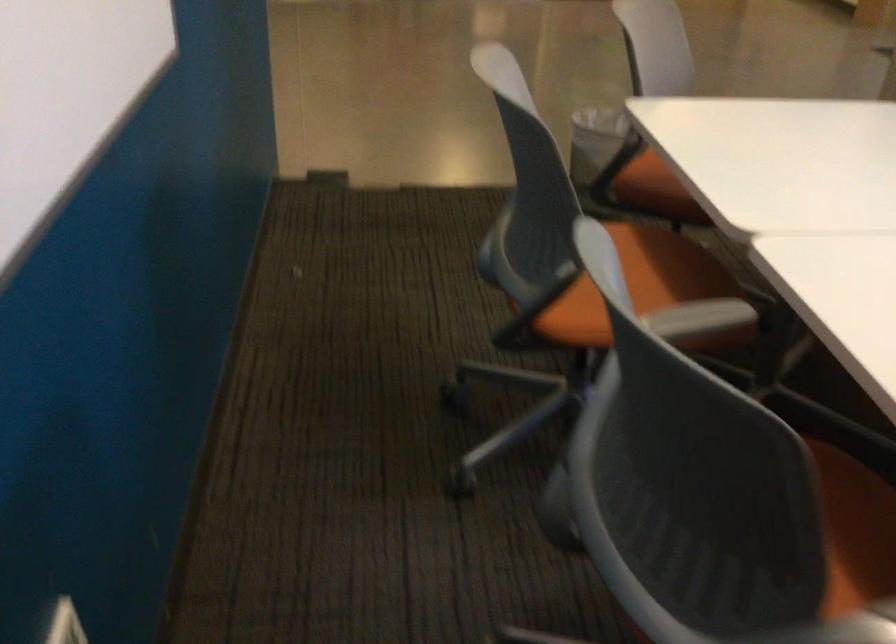
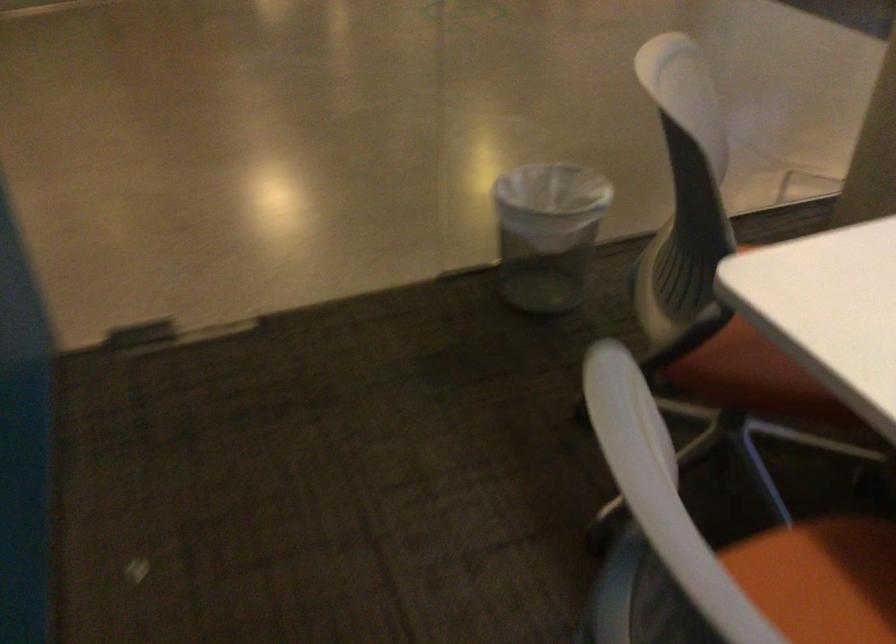
Question: In a continuous first-person perspective shot, in which direction is the camera moving?

Choices:
 (A) Left
 (B) Right
 (C) Forward
 (D) Backward

Answer: (C)